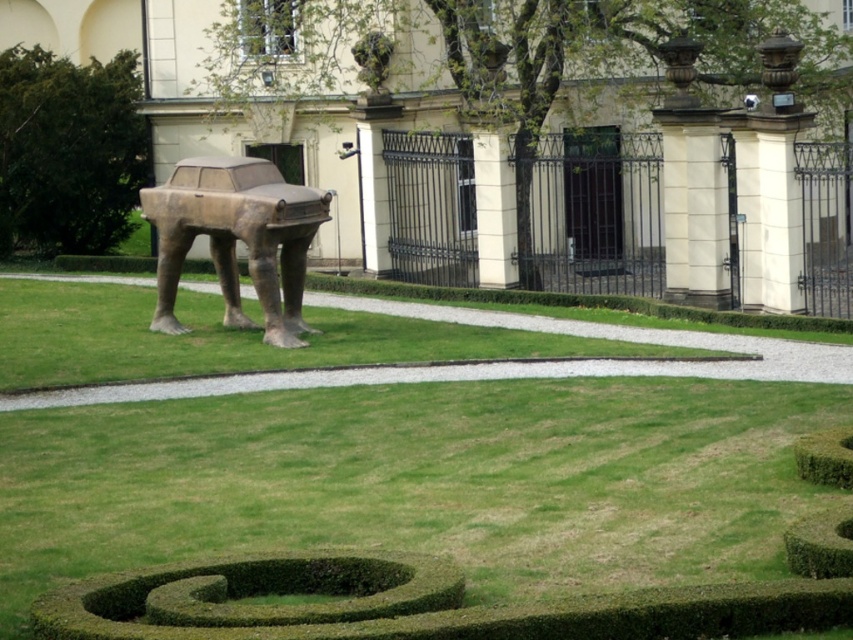
Question: Is the position of green grass at center more distant than that of green leafy hedge at center?

Choices:
 (A) no
 (B) yes

Answer: (A)

Question: Which of these objects is positioned farthest from the bronze statue at center?

Choices:
 (A) green leafy hedge at center
 (B) green grass at center

Answer: (A)

Question: Does green leafy hedge at center appear on the right side of bronze statue at center?

Choices:
 (A) no
 (B) yes

Answer: (A)

Question: Which object is the farthest from the green grass at center?

Choices:
 (A) bronze statue at center
 (B) green leafy hedge at center

Answer: (B)

Question: Which object is closer to the camera taking this photo?

Choices:
 (A) bronze statue at center
 (B) green grass at center
 (C) green leafy hedge at center

Answer: (B)

Question: From the image, what is the correct spatial relationship of green leafy hedge at center in relation to bronze statue at center?

Choices:
 (A) below
 (B) above

Answer: (B)